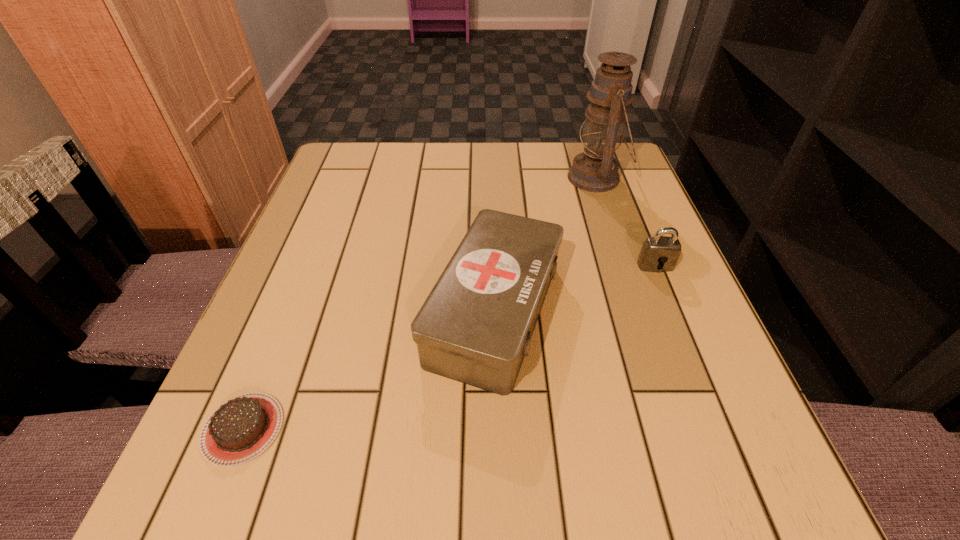
Image resolution: width=960 pixels, height=540 pixels. Identify the location of the farthest object. (595, 170).

Where is `the tallest object`? The image size is (960, 540). the tallest object is located at coordinates (595, 170).

At what (x,y) coordinates should I click in order to perform the action: click on the third object from right to left. Please return your answer as a coordinate pair (x, y). Looking at the image, I should click on (475, 327).

The height and width of the screenshot is (540, 960). Find the location of `padlock`. padlock is located at coordinates (660, 253).

This screenshot has height=540, width=960. Identify the location of the shortest object. (239, 430).

At what (x,y) coordinates should I click in order to perform the action: click on the leftmost object. Please return your answer as a coordinate pair (x, y). This screenshot has width=960, height=540. Looking at the image, I should click on (239, 430).

The width and height of the screenshot is (960, 540). Identify the location of free space located on the left of the oil lamp. (434, 178).

Where is `vacant space located on the back of the first-aid kit`? vacant space located on the back of the first-aid kit is located at coordinates (491, 192).

Where is `vacant space located 0.360m at the front of the padlock near the keyhole`? This screenshot has height=540, width=960. vacant space located 0.360m at the front of the padlock near the keyhole is located at coordinates (734, 458).

Where is `vacant space located 0.070m on the back of the shortest object`? The width and height of the screenshot is (960, 540). vacant space located 0.070m on the back of the shortest object is located at coordinates (272, 355).